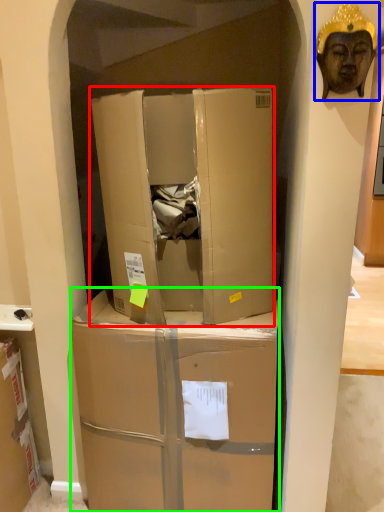
Question: Based on their relative distances, which object is farther from box (highlighted by a red box)? Choose from person (highlighted by a blue box) and box (highlighted by a green box).

Choices:
 (A) person
 (B) box

Answer: (A)